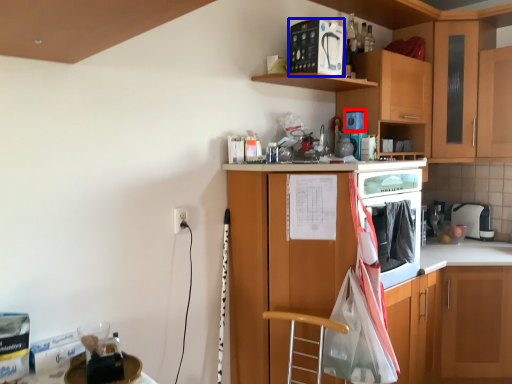
Question: Which of the following is the closest to the observer, appliance (highlighted by a red box) or appliance (highlighted by a blue box)?

Choices:
 (A) appliance
 (B) appliance

Answer: (B)